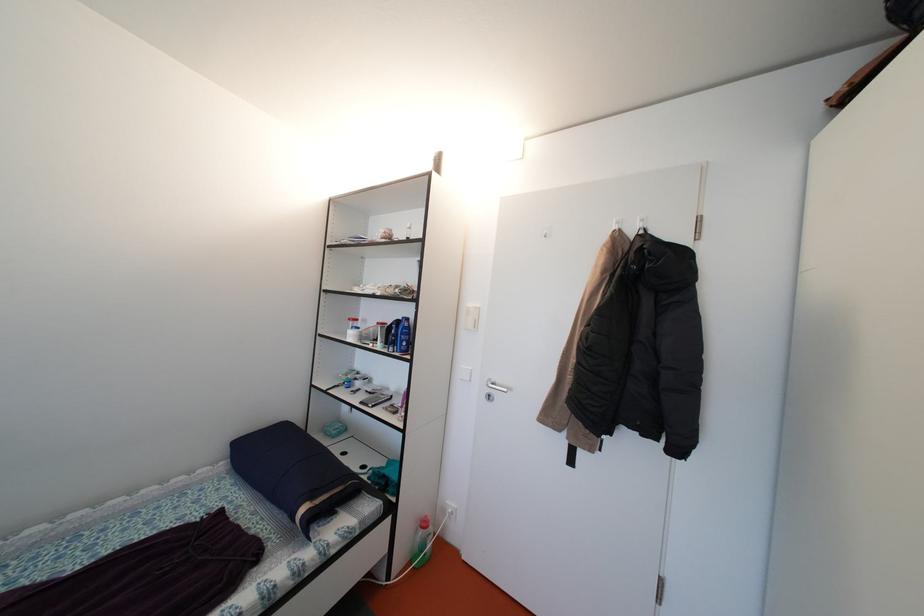
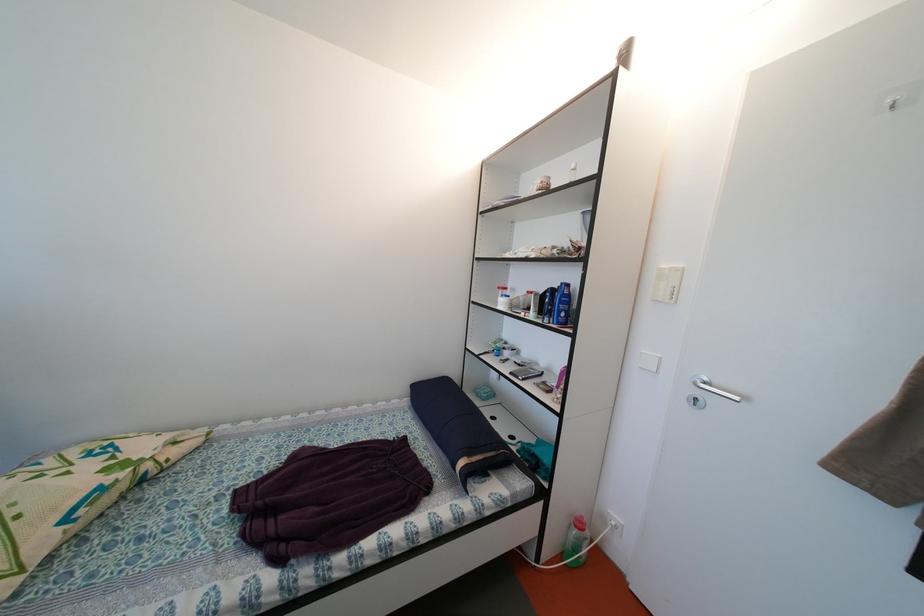
Find the pixel in the second image that matches pixel 451 517 in the first image.

(611, 525)